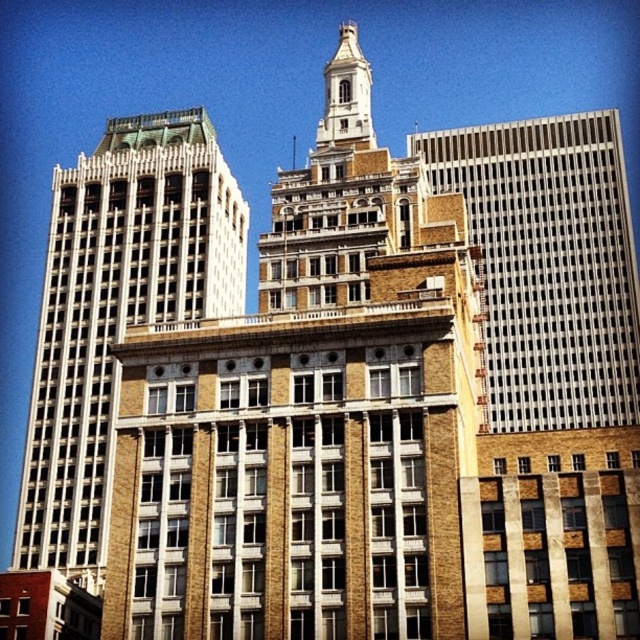
Question: Which point is closer to the camera?

Choices:
 (A) brown brick bell tower at upper left
 (B) brown stone tower at upper center

Answer: (B)

Question: Which of the following is the farthest from the observer?

Choices:
 (A) (40, 516)
 (B) (500, 298)
 (C) (326, 109)

Answer: (B)

Question: Is brown brick bell tower at upper left further to the viewer compared to white glass skyscraper at right?

Choices:
 (A) no
 (B) yes

Answer: (A)

Question: Is the position of brown brick bell tower at upper left more distant than that of brown stone tower at upper center?

Choices:
 (A) yes
 (B) no

Answer: (A)

Question: Which of the following is the farthest from the observer?

Choices:
 (A) white glass skyscraper at right
 (B) brown brick bell tower at upper left

Answer: (A)

Question: From the image, what is the correct spatial relationship of brown brick bell tower at upper left in relation to white glass skyscraper at right?

Choices:
 (A) left
 (B) right

Answer: (A)